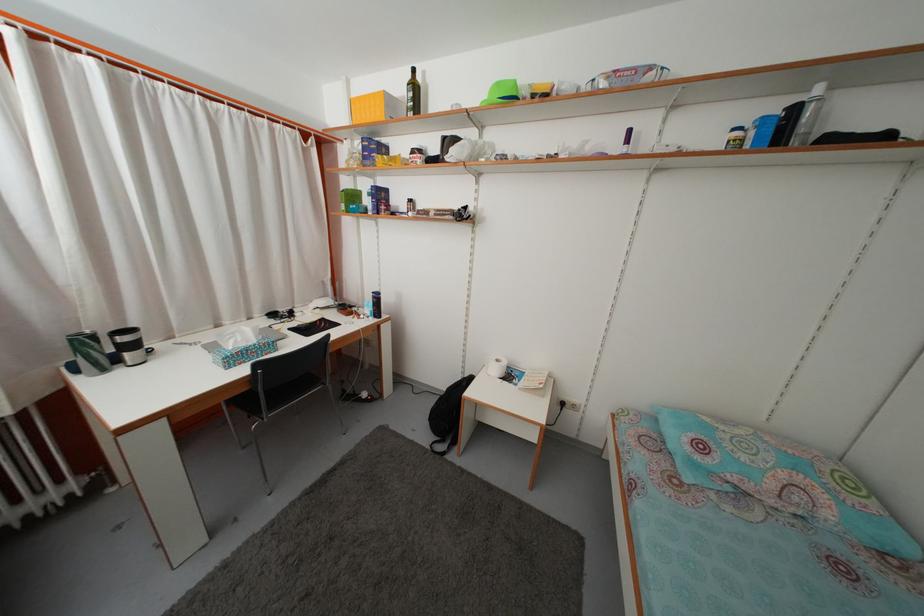
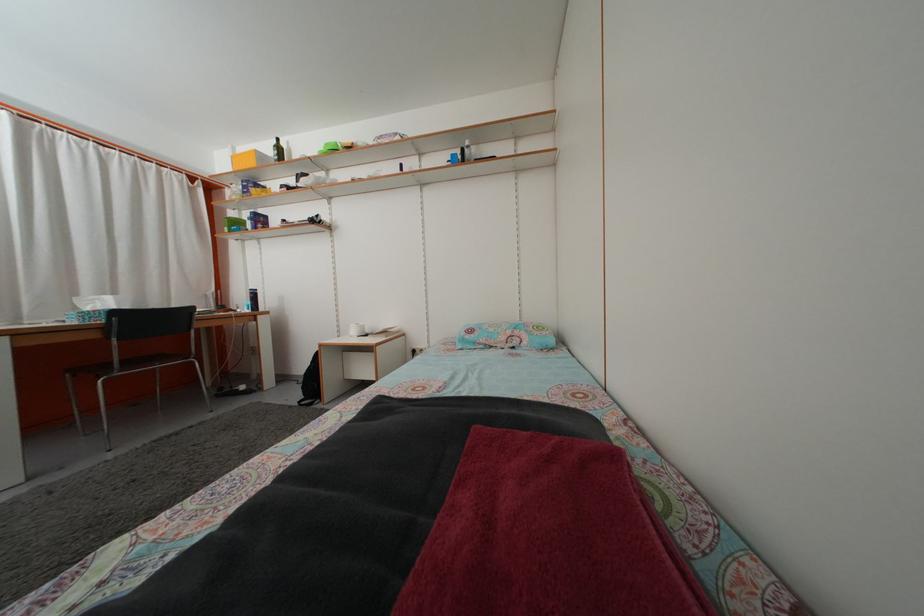
The point at (351, 190) is marked in the first image. Where is the corresponding point in the second image?

(237, 223)